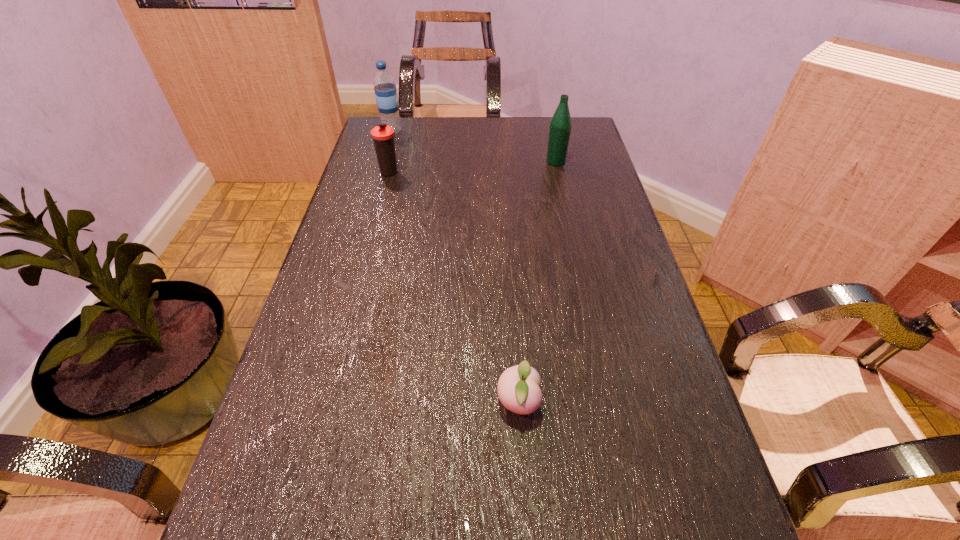
Identify the location of water bottle situated at the left edge. The width and height of the screenshot is (960, 540). (385, 90).

Where is `thermos bottle present at the left edge`? The image size is (960, 540). thermos bottle present at the left edge is located at coordinates (383, 135).

At what (x,y) coordinates should I click in order to perform the action: click on object located in the right edge section of the desktop. Please return your answer as a coordinate pair (x, y). This screenshot has height=540, width=960. Looking at the image, I should click on (560, 125).

Locate an element on the screen. The image size is (960, 540). object that is positioned at the far left corner is located at coordinates (385, 90).

Locate an element on the screen. vacant area at the far edge is located at coordinates (439, 126).

In the image, there is a desktop. At what (x,y) coordinates should I click in order to perform the action: click on free region at the left edge. Please return your answer as a coordinate pair (x, y). This screenshot has height=540, width=960. Looking at the image, I should click on (241, 503).

The height and width of the screenshot is (540, 960). I want to click on vacant space at the right edge of the desktop, so click(x=678, y=391).

In the image, there is a desktop. At what (x,y) coordinates should I click in order to perform the action: click on vacant space at the far left corner. Please return your answer as a coordinate pair (x, y). Image resolution: width=960 pixels, height=540 pixels. Looking at the image, I should click on (413, 149).

What are the coordinates of `vacant point located between the third tallest object and the shortest object` in the screenshot? It's located at (454, 287).

The height and width of the screenshot is (540, 960). I want to click on vacant region between the second shortest object and the bottle, so click(473, 167).